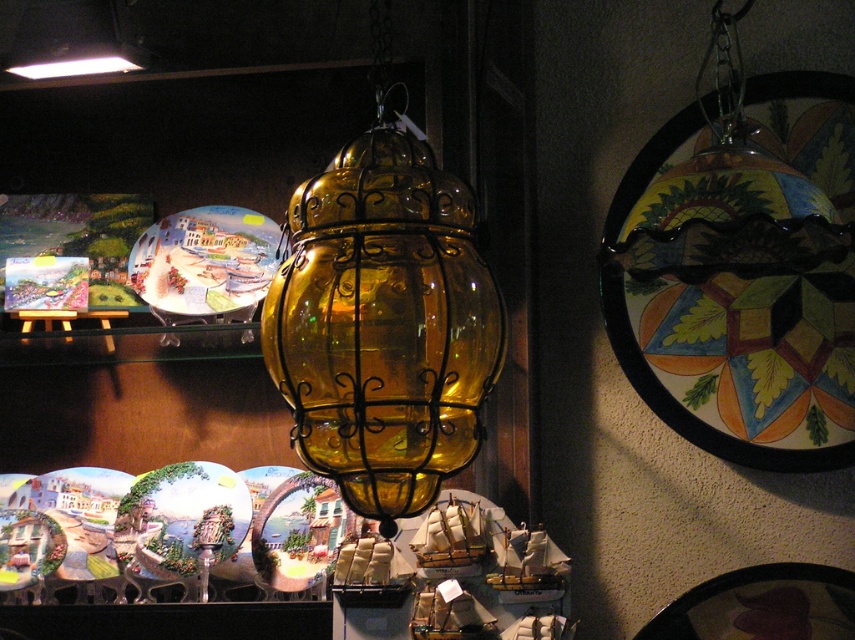
You are a customer in the shop and want to purchase the matte ceramic plate at upper center. However, the plate is placed above the amber glass lantern at center. Can you reach it without moving the lantern?

The matte ceramic plate at upper center is positioned above the amber glass lantern at center, so you can reach it without needing to move the lantern since it is placed higher up.

You are an interior designer assessing the space. The amber glass lantern at center and the matte ceramic plate at upper center are both in view. Which object has a greater width?

The amber glass lantern at center has a greater width than the matte ceramic plate at upper center.

You are an interior designer assessing the space. The amber glass lantern at center and the matte ceramic plate at upper center are both in view. Which object is taller?

The amber glass lantern at center is taller than the matte ceramic plate at upper center.